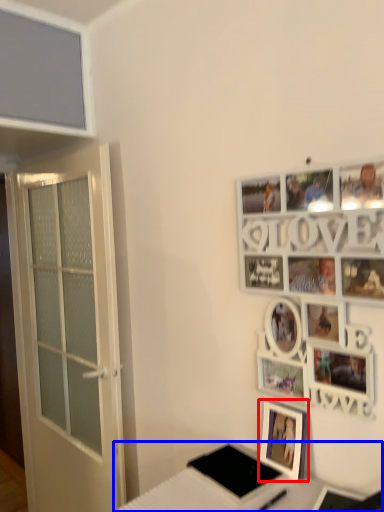
Question: Which point is further to the camera, picture frame (highlighted by a red box) or table (highlighted by a blue box)?

Choices:
 (A) picture frame
 (B) table

Answer: (A)